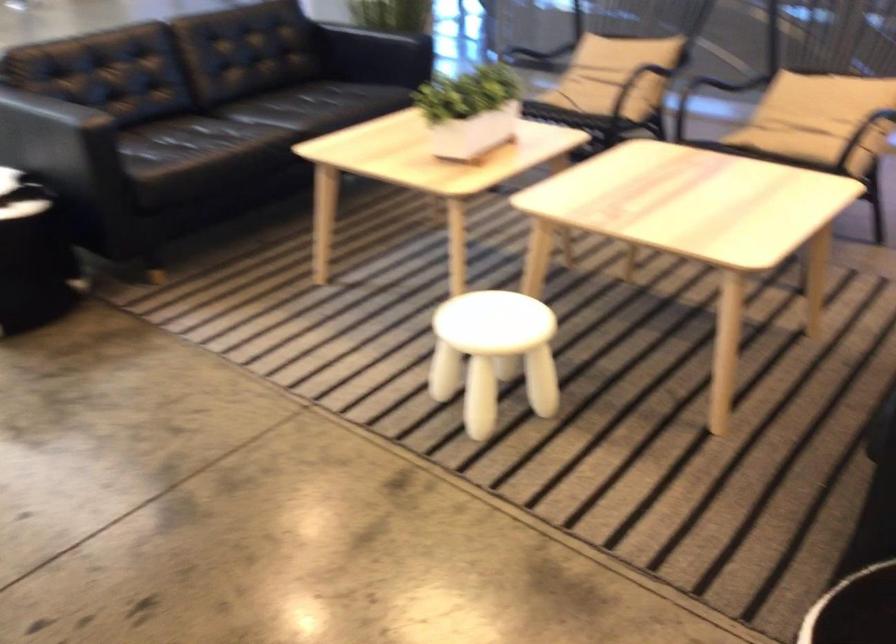
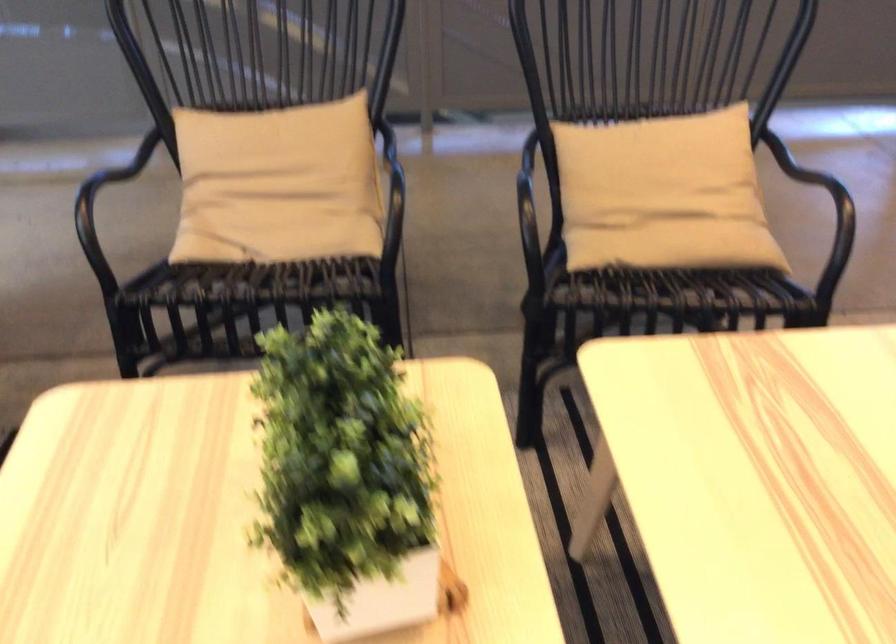
Where in the second image is the point corresponding to [438,87] from the first image?

(346, 477)